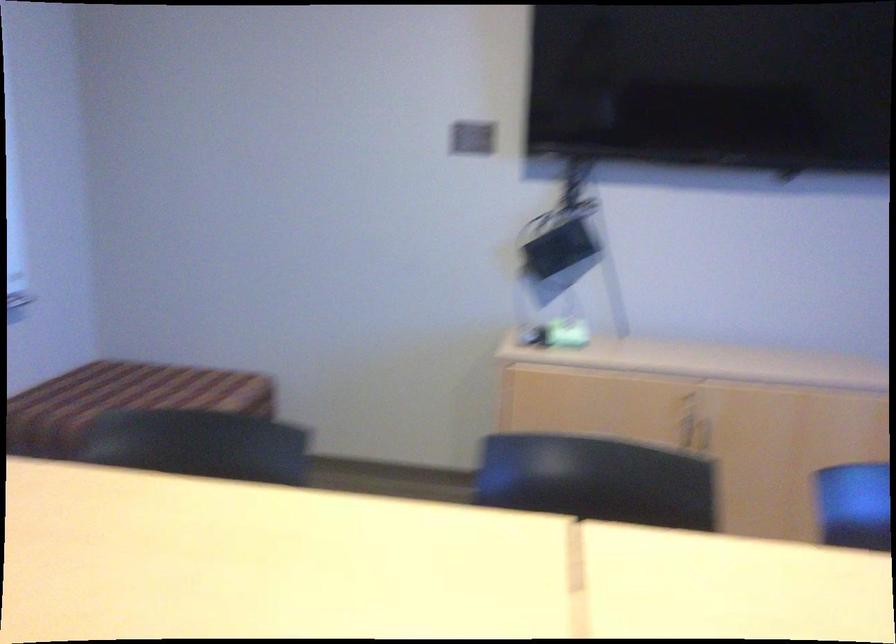
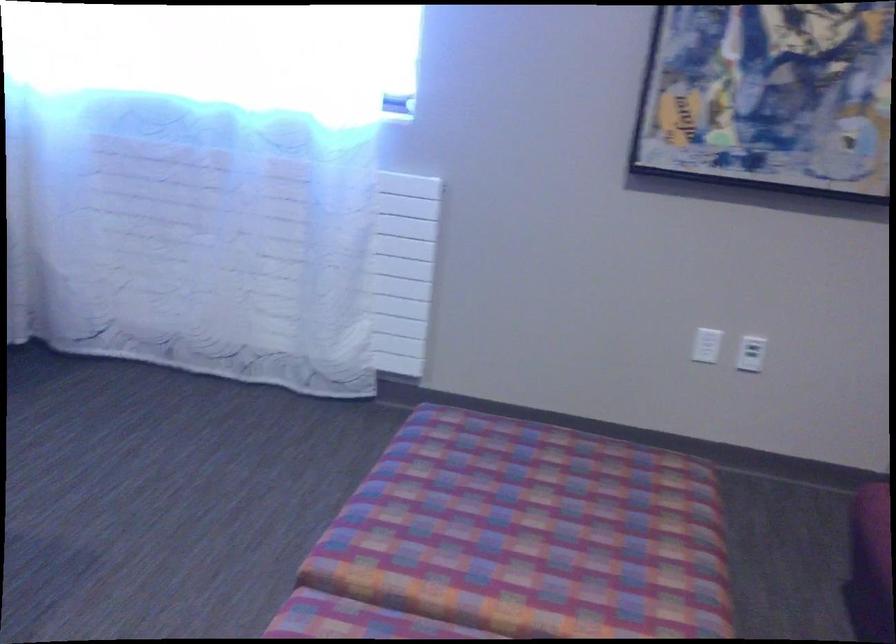
The images are taken continuously from a first-person perspective. In which direction is your viewpoint rotating?

The rotation direction of the camera is right-down.